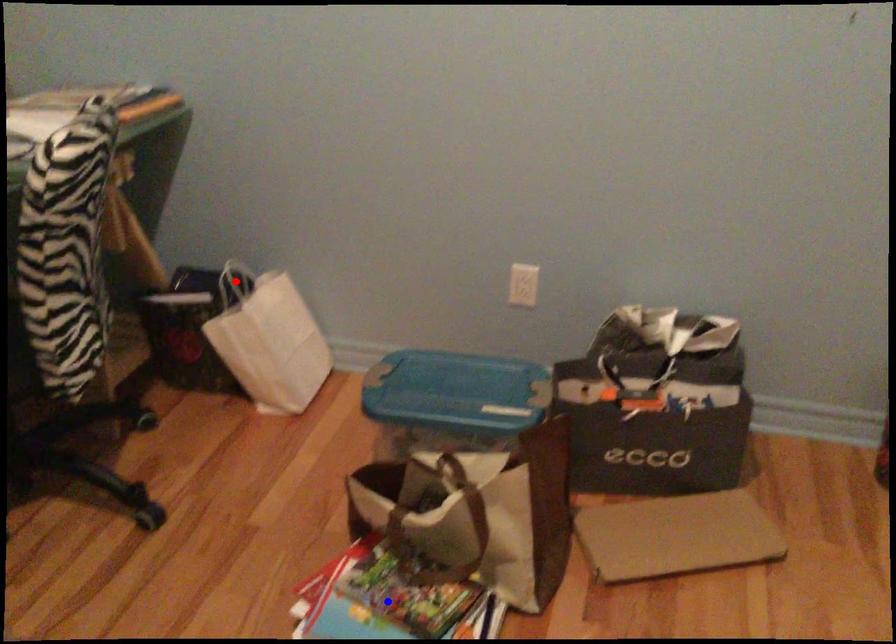
Question: Two points are marked on the image. Which point is closer to the camera?

Choices:
 (A) Blue point is closer.
 (B) Red point is closer.

Answer: (A)